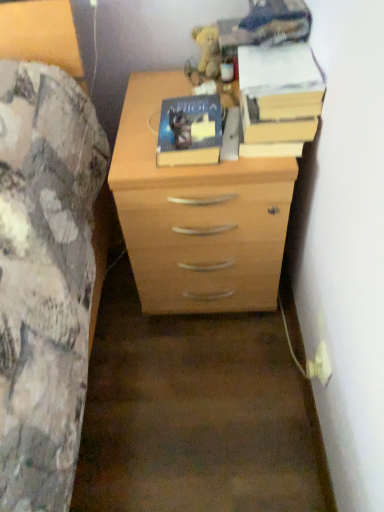
Question: Is yellow paper at upper right, positioned as the 1th paperback book in right-to-left order, to the left or to the right of white plastic plug at lower right in the image?

Choices:
 (A) left
 (B) right

Answer: (A)

Question: Is point (241, 49) positioned closer to the camera than point (324, 354)?

Choices:
 (A) farther
 (B) closer

Answer: (A)

Question: Estimate the real-world distances between objects in this image. Which object is closer to the light wood chest of drawers at center?

Choices:
 (A) fuzzy yellow plush at upper center
 (B) white plastic plug at lower right
 (C) yellow paper at upper right, positioned as the 1th paperback book in right-to-left order
 (D) hardcover book at center, which appears as the 2th paperback book when viewed from the right

Answer: (D)

Question: Estimate the real-world distances between objects in this image. Which object is farther from the fuzzy yellow plush at upper center?

Choices:
 (A) light wood chest of drawers at center
 (B) yellow paper at upper right, positioned as the 1th paperback book in right-to-left order
 (C) white plastic plug at lower right
 (D) hardcover book at center, which appears as the 2th paperback book when viewed from the right

Answer: (C)